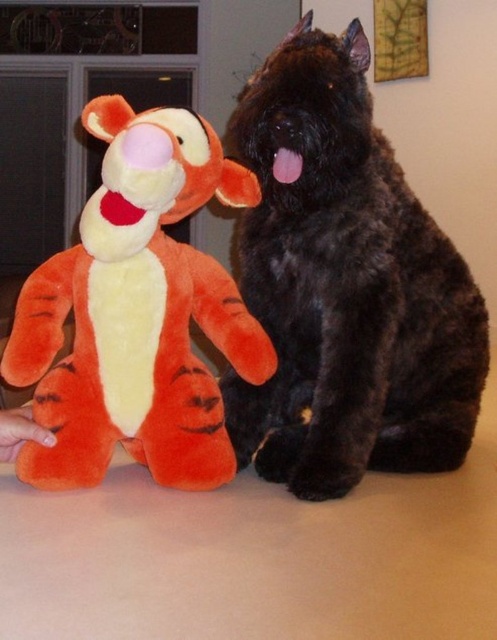
You are a child who wants to hug both the black furry dog at center and the orange plush toy at left. Which one do you need to bend down more to hug?

The black furry dog at center is bigger than the orange plush toy at left, so you need to bend down more to hug the black furry dog at center.